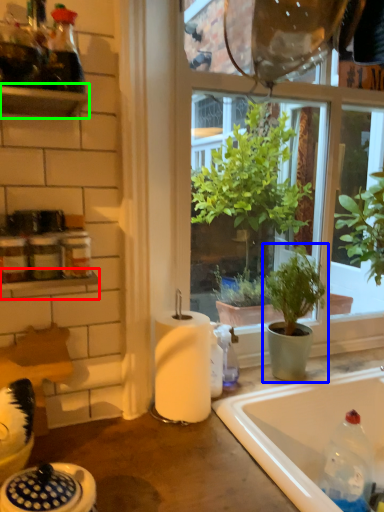
Question: Estimate the real-world distances between objects in this image. Which object is closer to window sill (highlighted by a red box), houseplant (highlighted by a blue box) or shelf (highlighted by a green box)?

Choices:
 (A) houseplant
 (B) shelf

Answer: (B)